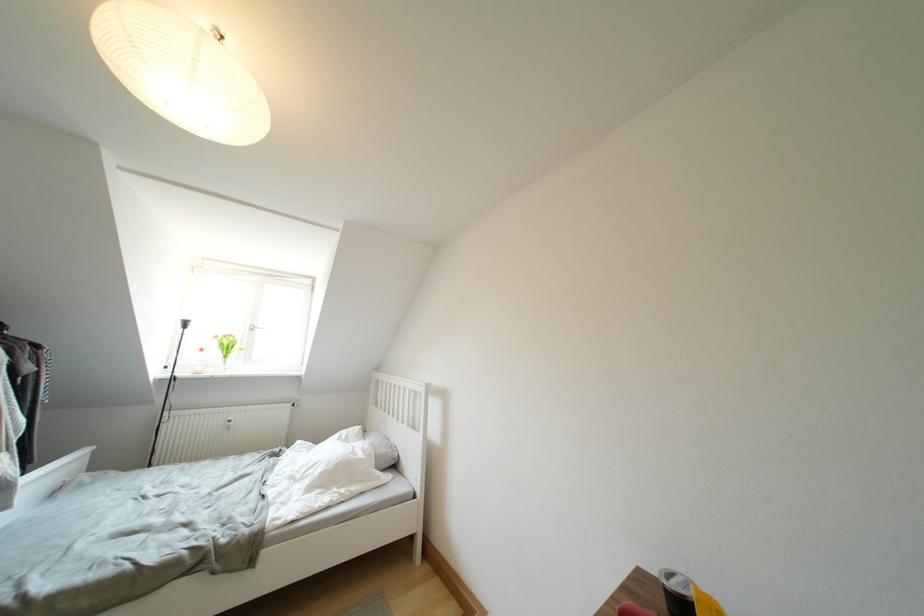
What do you see at coordinates (254, 328) in the screenshot?
I see `the window handle` at bounding box center [254, 328].